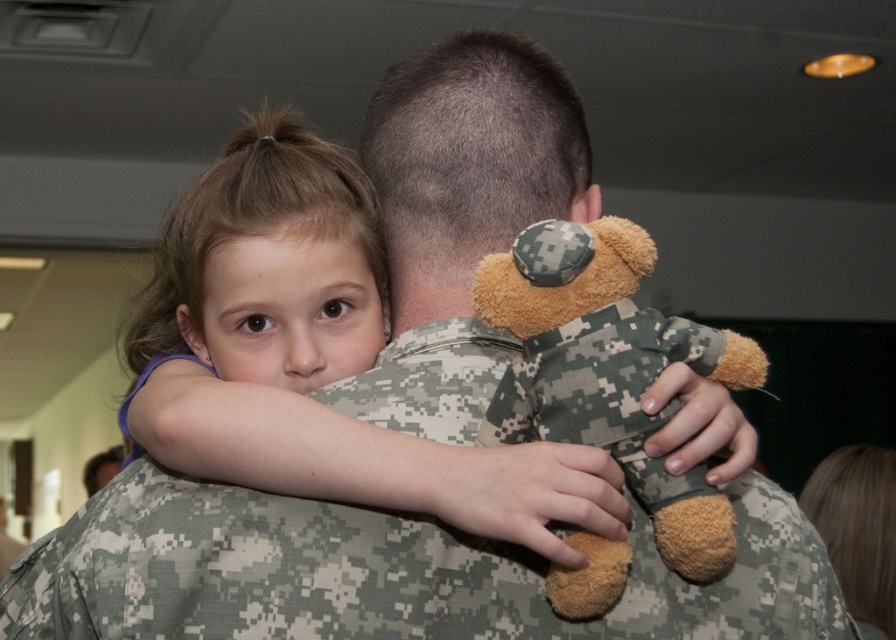
In the scene where a soldier in a camouflage fabric uniform at back is hugging a child with matte brown hair at upper left, which object takes up more horizontal space?

The camouflage fabric uniform at back takes up more horizontal space because its width is larger than that of the matte brown hair at upper left.

You need to determine which object is bigger between the camouflage fabric uniform at back and the camouflage fabric teddy bear at upper center. Which one is larger?

The camouflage fabric uniform at back is larger than the camouflage fabric teddy bear at upper center according to the description.

Looking at the image, which object has a greater width between the matte brown hair at upper left and the camouflage fabric teddy bear at upper center?

The matte brown hair at upper left has a greater width than the camouflage fabric teddy bear at upper center according to the description.